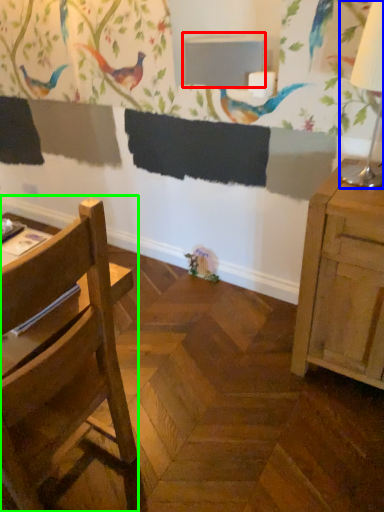
Question: Estimate the real-world distances between objects in this image. Which object is farther from table (highlighted by a red box), table lamp (highlighted by a blue box) or chair (highlighted by a green box)?

Choices:
 (A) table lamp
 (B) chair

Answer: (B)